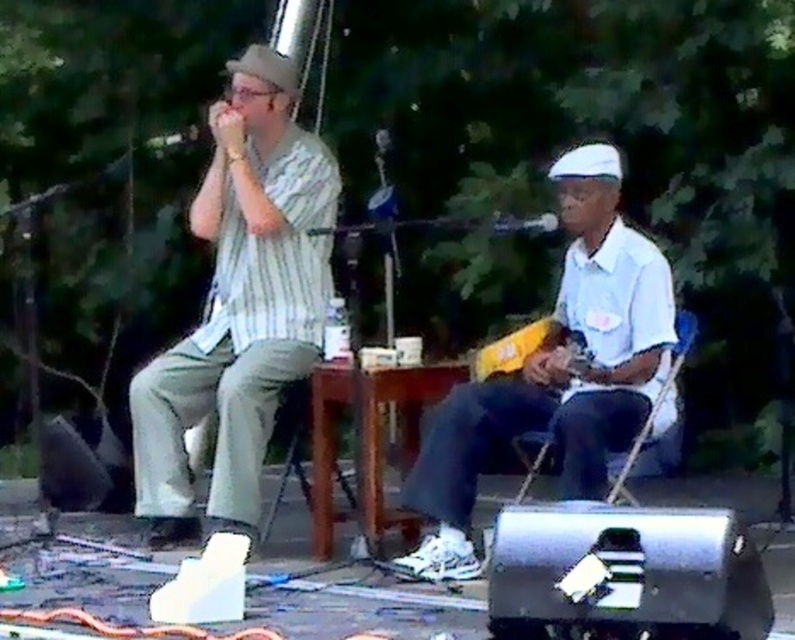
Question: Is striped cotton shirt at center wider than white matte shirt at center?

Choices:
 (A) no
 (B) yes

Answer: (A)

Question: Does striped cotton shirt at center have a larger size compared to white matte shirt at center?

Choices:
 (A) yes
 (B) no

Answer: (A)

Question: Among these objects, which one is farthest from the camera?

Choices:
 (A) striped cotton shirt at center
 (B) white matte shirt at center

Answer: (A)

Question: Can you confirm if striped cotton shirt at center is bigger than white matte shirt at center?

Choices:
 (A) yes
 (B) no

Answer: (A)

Question: Which point is closer to the camera?

Choices:
 (A) striped cotton shirt at center
 (B) white matte shirt at center

Answer: (B)